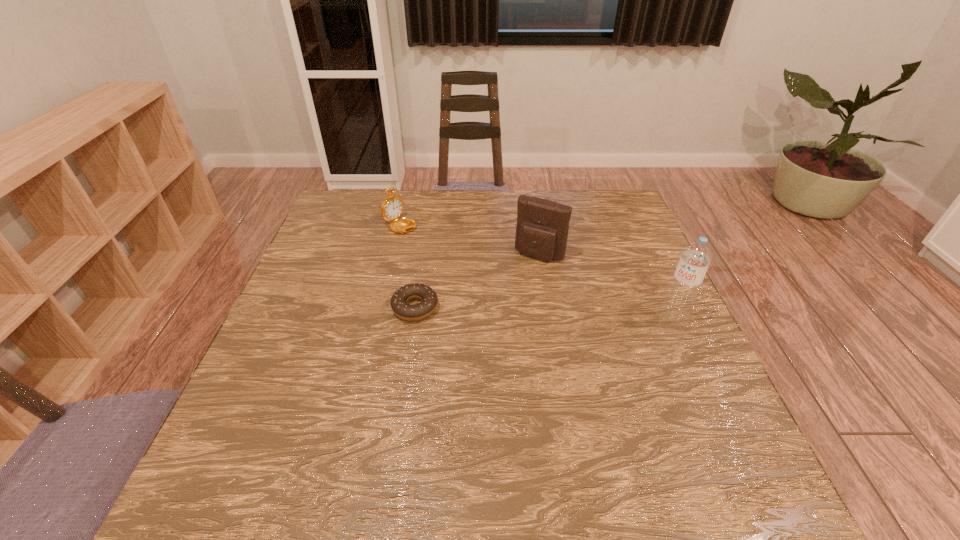
Identify the location of vacant area that lies between the third nearest object and the rightmost object. (607, 285).

Image resolution: width=960 pixels, height=540 pixels. Identify the location of vacant area between the doughnut and the tallest object. (544, 312).

Locate an element on the screen. The width and height of the screenshot is (960, 540). blank region between the farthest object and the rightmost object is located at coordinates pyautogui.click(x=540, y=268).

Select which object appears as the closest to the third tallest object. Please provide its 2D coordinates. Your answer should be formatted as a tuple, i.e. [(x, y)], where the tuple contains the x and y coordinates of a point satisfying the conditions above.

[(398, 302)]

Identify the location of the third closest object to the shortest object. The image size is (960, 540). (696, 257).

Where is `vacant space that satisfies the following two spatial constraints: 1. on the front side of the second shortest object; 2. on the left side of the rightmost object`? The height and width of the screenshot is (540, 960). vacant space that satisfies the following two spatial constraints: 1. on the front side of the second shortest object; 2. on the left side of the rightmost object is located at coordinates (386, 315).